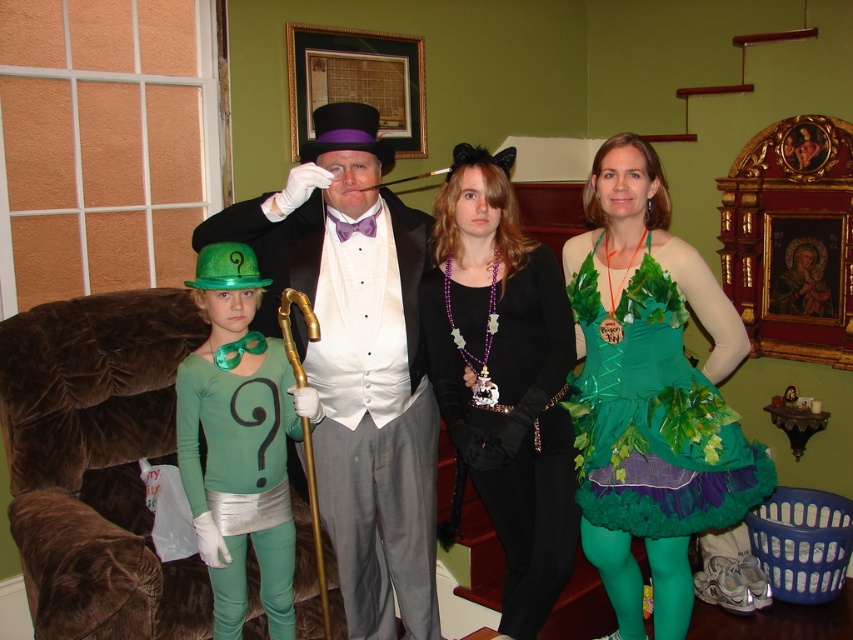
Question: Is shiny black suit at center below green fabric dress at center?

Choices:
 (A) yes
 (B) no

Answer: (B)

Question: Which point is farther to the camera?

Choices:
 (A) (453, 177)
 (B) (280, 621)
 (C) (669, 531)
 (D) (361, 636)

Answer: (D)

Question: Can you confirm if green fabric dress at center is positioned above green matte tights at left?

Choices:
 (A) yes
 (B) no

Answer: (A)

Question: Which of the following is the closest to the observer?

Choices:
 (A) [x=527, y=595]
 (B) [x=332, y=324]
 (C) [x=195, y=444]

Answer: (B)

Question: Which object is farther from the camera taking this photo?

Choices:
 (A) green fabric dress at center
 (B) green matte tights at left
 (C) black velvet dress at center

Answer: (A)

Question: Can you confirm if green fabric dress at center is smaller than green matte tights at left?

Choices:
 (A) no
 (B) yes

Answer: (A)